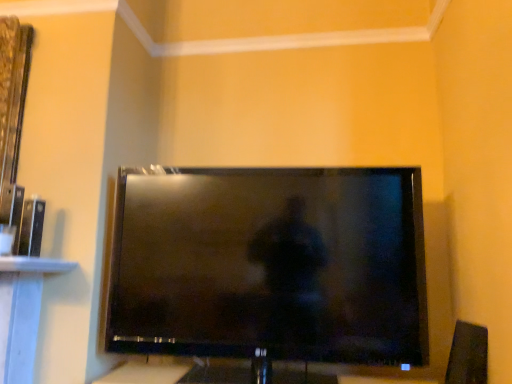
Find the location of a particular element. black glossy tv at center is located at coordinates (270, 265).

What is the approximate height of black glossy tv at center?

black glossy tv at center is 74.72 centimeters tall.

Measure the distance between point [344,175] and camera.

A distance of 5.03 feet exists between point [344,175] and camera.

What do you see at coordinates (270, 265) in the screenshot? I see `black glossy tv at center` at bounding box center [270, 265].

What do you see at coordinates (468, 355) in the screenshot?
I see `black plastic speaker at lower right` at bounding box center [468, 355].

Looking at this image, what is the approximate height of black plastic speaker at lower right?

black plastic speaker at lower right is 9.59 inches tall.

I want to click on black plastic speaker at lower right, so click(468, 355).

At what (x,y) coordinates should I click in order to perform the action: click on black glossy tv at center. Please return your answer as a coordinate pair (x, y). The width and height of the screenshot is (512, 384). Looking at the image, I should click on (270, 265).

Between black glossy tv at center and black plastic speaker at lower right, which one appears on the left side from the viewer's perspective?

black glossy tv at center is more to the left.

Considering the positions of objects black glossy tv at center and black plastic speaker at lower right in the image provided, who is behind, black glossy tv at center or black plastic speaker at lower right?

black plastic speaker at lower right is further away from the camera.

Is point (303, 275) closer to viewer compared to point (486, 338)?

No, it is not.

From the image's perspective, is black glossy tv at center located above or below black plastic speaker at lower right?

Based on their image positions, black glossy tv at center is located above black plastic speaker at lower right.

From a real-world perspective, relative to black plastic speaker at lower right, is black glossy tv at center vertically above or below?

In terms of real-world spatial position, black glossy tv at center is above black plastic speaker at lower right.

In terms of width, does black glossy tv at center look wider or thinner when compared to black plastic speaker at lower right?

black glossy tv at center is wider than black plastic speaker at lower right.

Considering the sizes of objects black glossy tv at center and black plastic speaker at lower right in the image provided, who is shorter, black glossy tv at center or black plastic speaker at lower right?

black plastic speaker at lower right is shorter.

Does black glossy tv at center have a larger size compared to black plastic speaker at lower right?

Yes, black glossy tv at center is bigger than black plastic speaker at lower right.

Is black glossy tv at center situated inside black plastic speaker at lower right or outside?

black glossy tv at center is not inside black plastic speaker at lower right, it's outside.

Is black glossy tv at center placed right next to black plastic speaker at lower right?

No, black glossy tv at center is not touching black plastic speaker at lower right.

Is black glossy tv at center looking in the opposite direction of black plastic speaker at lower right?

No, black plastic speaker at lower right is not at the back of black glossy tv at center.

This screenshot has width=512, height=384. In order to click on speaker located behind the black glossy tv at center in this screenshot , I will do `click(468, 355)`.

In the scene shown: Which object is positioned more to the right, black plastic speaker at lower right or black glossy tv at center?

Positioned to the right is black plastic speaker at lower right.

Is black plastic speaker at lower right closer to camera compared to black glossy tv at center?

No, black plastic speaker at lower right is further to the viewer.

Consider the image. Which is closer, (461, 374) or (300, 337)?

Point (461, 374) appears to be closer to the viewer than point (300, 337).

Based on the photo, from the image's perspective, is black plastic speaker at lower right located above or below black glossy tv at center?

black plastic speaker at lower right is situated lower than black glossy tv at center in the image.

From a real-world perspective, does black plastic speaker at lower right stand above black glossy tv at center?

No, from a real-world perspective, black plastic speaker at lower right is not over black glossy tv at center

Considering the sizes of objects black plastic speaker at lower right and black glossy tv at center in the image provided, who is thinner, black plastic speaker at lower right or black glossy tv at center?

black plastic speaker at lower right.

Can you confirm if black plastic speaker at lower right is shorter than black glossy tv at center?

Yes.

Which of these two, black plastic speaker at lower right or black glossy tv at center, is smaller?

black plastic speaker at lower right is smaller.

Does black plastic speaker at lower right contain black glossy tv at center?

That's incorrect, black glossy tv at center is not inside black plastic speaker at lower right.

Is black plastic speaker at lower right not close to black glossy tv at center?

No.

In the scene shown: Is black plastic speaker at lower right turned away from black glossy tv at center?

No, black glossy tv at center is not at the back of black plastic speaker at lower right.

What's the angular difference between black plastic speaker at lower right and black glossy tv at center's facing directions?

The angular difference between black plastic speaker at lower right and black glossy tv at center is 4.11 degrees.

Identify the location of television that appears in front of the black plastic speaker at lower right. The width and height of the screenshot is (512, 384). (270, 265).

Locate an element on the screen. The image size is (512, 384). speaker below the black glossy tv at center (from the image's perspective) is located at coordinates (468, 355).

At what (x,y) coordinates should I click in order to perform the action: click on television above the black plastic speaker at lower right (from the image's perspective). Please return your answer as a coordinate pair (x, y). Image resolution: width=512 pixels, height=384 pixels. Looking at the image, I should click on (270, 265).